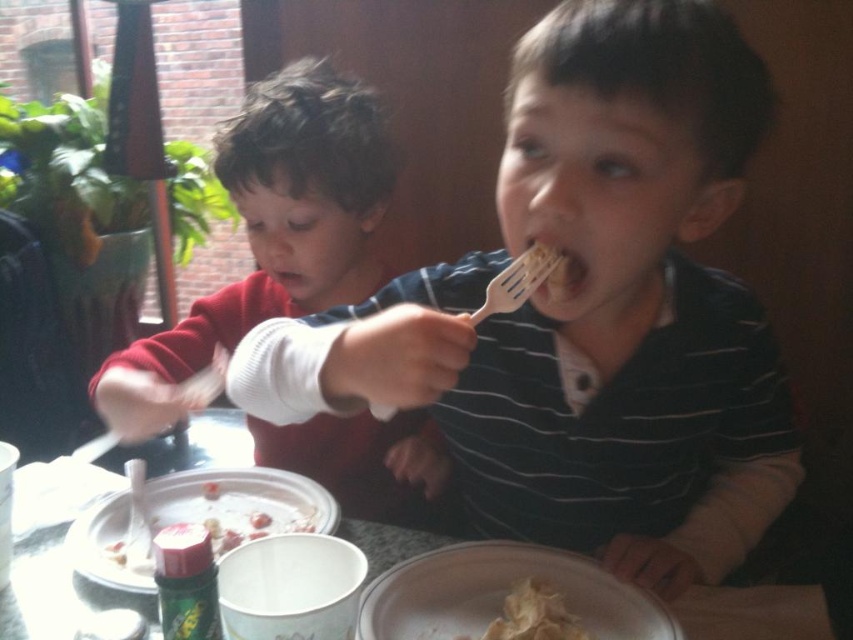
Question: Which point is closer to the camera?

Choices:
 (A) click(x=96, y=529)
 (B) click(x=552, y=250)
 (C) click(x=511, y=564)

Answer: (B)

Question: Does matte red sweater at left have a greater width compared to white matte plate at lower center?

Choices:
 (A) yes
 (B) no

Answer: (A)

Question: Which object is positioned closest to the matte red sweater at left?

Choices:
 (A) matte plastic fork at center
 (B) plastic disposable plate at lower left
 (C) white crumbly food at lower center

Answer: (B)

Question: Does white matte plate at lower center appear over white plastic fork at upper center?

Choices:
 (A) yes
 (B) no

Answer: (B)

Question: Among these points, which one is nearest to the camera?

Choices:
 (A) (93, 548)
 (B) (387, 628)

Answer: (B)

Question: Considering the relative positions of matte red sweater at left and white matte plate at lower center in the image provided, where is matte red sweater at left located with respect to white matte plate at lower center?

Choices:
 (A) left
 (B) right

Answer: (A)